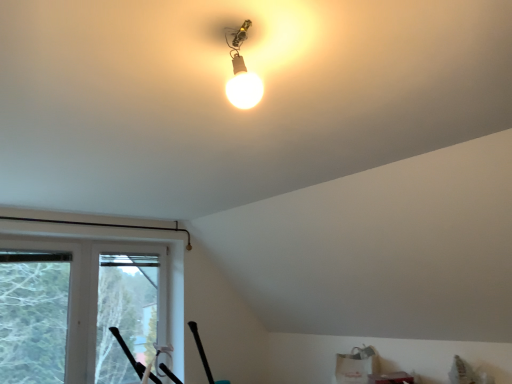
What do you see at coordinates (241, 72) in the screenshot?
I see `matte glass bulb at upper center` at bounding box center [241, 72].

This screenshot has width=512, height=384. What do you see at coordinates (33, 316) in the screenshot?
I see `transparent plastic window screen at left, which is counted as the 1th window screen, starting from the left` at bounding box center [33, 316].

What is the approximate height of transparent plastic window screen at lower left, which appears as the first window screen when viewed from the right?

It is 4.43 feet.

Locate an element on the screen. The image size is (512, 384). matte glass bulb at upper center is located at coordinates (241, 72).

Considering the relative sizes of transparent plastic window screen at left, which is the 2th window screen from right to left, and matte glass bulb at upper center in the image provided, is transparent plastic window screen at left, which is the 2th window screen from right to left, shorter than matte glass bulb at upper center?

No, transparent plastic window screen at left, which is the 2th window screen from right to left, is not shorter than matte glass bulb at upper center.

Is matte glass bulb at upper center located within transparent plastic window screen at left, which is the 2th window screen from right to left?

No, matte glass bulb at upper center is not surrounded by transparent plastic window screen at left, which is the 2th window screen from right to left.

Can you confirm if transparent plastic window screen at left, which is the 2th window screen from right to left, is bigger than matte glass bulb at upper center?

Indeed, transparent plastic window screen at left, which is the 2th window screen from right to left, has a larger size compared to matte glass bulb at upper center.

In the scene shown: Is transparent plastic window screen at left, which is the 2th window screen from right to left, to the left or to the right of matte glass bulb at upper center in the image?

Clearly, transparent plastic window screen at left, which is the 2th window screen from right to left, is on the left of matte glass bulb at upper center in the image.

In the scene shown: From a real-world perspective, is matte glass bulb at upper center physically located above or below transparent plastic window screen at left, which is counted as the 1th window screen, starting from the left?

In terms of real-world spatial position, matte glass bulb at upper center is above transparent plastic window screen at left, which is counted as the 1th window screen, starting from the left.

Could you tell me if matte glass bulb at upper center is turned towards transparent plastic window screen at left, which is the 2th window screen from right to left?

No, matte glass bulb at upper center is not aimed at transparent plastic window screen at left, which is the 2th window screen from right to left.

Between matte glass bulb at upper center and transparent plastic window screen at left, which is the 2th window screen from right to left, which one has larger width?

With larger width is matte glass bulb at upper center.

From a real-world perspective, is transparent plastic window screen at left, which is counted as the 1th window screen, starting from the left, positioned over transparent plastic window screen at lower left, which appears as the first window screen when viewed from the right, based on gravity?

Indeed, from a real-world perspective, transparent plastic window screen at left, which is counted as the 1th window screen, starting from the left, stands above transparent plastic window screen at lower left, which appears as the first window screen when viewed from the right.

Choose the correct answer: Is transparent plastic window screen at left, which is counted as the 1th window screen, starting from the left, inside transparent plastic window screen at lower left, which appears as the second window screen when viewed from the left, or outside it?

transparent plastic window screen at left, which is counted as the 1th window screen, starting from the left, is not enclosed by transparent plastic window screen at lower left, which appears as the second window screen when viewed from the left.

Is transparent plastic window screen at left, which is counted as the 1th window screen, starting from the left, not near transparent plastic window screen at lower left, which appears as the second window screen when viewed from the left?

No, transparent plastic window screen at left, which is counted as the 1th window screen, starting from the left, is not far from transparent plastic window screen at lower left, which appears as the second window screen when viewed from the left.

Which is nearer, (53, 337) or (129, 346)?

The point (53, 337) is more forward.

Considering the relative positions of transparent plastic window screen at lower left, which appears as the second window screen when viewed from the left, and transparent plastic window screen at left, which is counted as the 1th window screen, starting from the left, in the image provided, is transparent plastic window screen at lower left, which appears as the second window screen when viewed from the left, to the left of transparent plastic window screen at left, which is counted as the 1th window screen, starting from the left, from the viewer's perspective?

No, transparent plastic window screen at lower left, which appears as the second window screen when viewed from the left, is not to the left of transparent plastic window screen at left, which is counted as the 1th window screen, starting from the left.

This screenshot has height=384, width=512. In order to click on window screen lying on the right of transparent plastic window screen at left, which is the 2th window screen from right to left in this screenshot , I will do `click(126, 315)`.

Based on the photo, which of these two, transparent plastic window screen at lower left, which appears as the second window screen when viewed from the left, or transparent plastic window screen at left, which is counted as the 1th window screen, starting from the left, is bigger?

transparent plastic window screen at lower left, which appears as the second window screen when viewed from the left, is bigger.

Who is more distant, transparent plastic window screen at lower left, which appears as the second window screen when viewed from the left, or transparent plastic window screen at left, which is the 2th window screen from right to left?

Positioned behind is transparent plastic window screen at lower left, which appears as the second window screen when viewed from the left.

Is matte glass bulb at upper center a part of transparent plastic window screen at lower left, which appears as the first window screen when viewed from the right?

No, matte glass bulb at upper center is not surrounded by transparent plastic window screen at lower left, which appears as the first window screen when viewed from the right.

How far apart are transparent plastic window screen at lower left, which appears as the second window screen when viewed from the left, and matte glass bulb at upper center?

A distance of 3.34 meters exists between transparent plastic window screen at lower left, which appears as the second window screen when viewed from the left, and matte glass bulb at upper center.

Is point (119, 379) closer to viewer compared to point (250, 96)?

No, (119, 379) is further to viewer.

From a real-world perspective, between transparent plastic window screen at lower left, which appears as the first window screen when viewed from the right, and matte glass bulb at upper center, who is vertically lower?

From a 3D spatial view, transparent plastic window screen at lower left, which appears as the first window screen when viewed from the right, is below.

From a real-world perspective, is matte glass bulb at upper center above or below transparent plastic window screen at lower left, which appears as the second window screen when viewed from the left?

matte glass bulb at upper center is situated higher than transparent plastic window screen at lower left, which appears as the second window screen when viewed from the left, in the real world.

Based on the photo, is matte glass bulb at upper center positioned beyond the bounds of transparent plastic window screen at lower left, which appears as the first window screen when viewed from the right?

Indeed, matte glass bulb at upper center is completely outside transparent plastic window screen at lower left, which appears as the first window screen when viewed from the right.

Which of these two, matte glass bulb at upper center or transparent plastic window screen at lower left, which appears as the first window screen when viewed from the right, stands taller?

Standing taller between the two is transparent plastic window screen at lower left, which appears as the first window screen when viewed from the right.

From the image's perspective, is matte glass bulb at upper center over transparent plastic window screen at lower left, which appears as the first window screen when viewed from the right?

Indeed, from the image's perspective, matte glass bulb at upper center is shown above transparent plastic window screen at lower left, which appears as the first window screen when viewed from the right.

The width and height of the screenshot is (512, 384). I want to click on lamp that appears in front of the transparent plastic window screen at left, which is counted as the 1th window screen, starting from the left, so click(241, 72).

Starting from the matte glass bulb at upper center, which window screen is the 1st one behind? Please provide its 2D coordinates.

[(33, 316)]

Looking at this image, looking at the image, which one is located closer to transparent plastic window screen at left, which is the 2th window screen from right to left, matte glass bulb at upper center or transparent plastic window screen at lower left, which appears as the second window screen when viewed from the left?

transparent plastic window screen at lower left, which appears as the second window screen when viewed from the left, is positioned closer to the anchor transparent plastic window screen at left, which is the 2th window screen from right to left.

Looking at the image, which one is located further to transparent plastic window screen at lower left, which appears as the first window screen when viewed from the right, transparent plastic window screen at left, which is the 2th window screen from right to left, or matte glass bulb at upper center?

Among the two, matte glass bulb at upper center is located further to transparent plastic window screen at lower left, which appears as the first window screen when viewed from the right.

When comparing their distances from matte glass bulb at upper center, does transparent plastic window screen at lower left, which appears as the second window screen when viewed from the left, or transparent plastic window screen at left, which is counted as the 1th window screen, starting from the left, seem further?

Among the two, transparent plastic window screen at lower left, which appears as the second window screen when viewed from the left, is located further to matte glass bulb at upper center.

From the image, which object appears to be nearer to transparent plastic window screen at left, which is counted as the 1th window screen, starting from the left, transparent plastic window screen at lower left, which appears as the second window screen when viewed from the left, or matte glass bulb at upper center?

transparent plastic window screen at lower left, which appears as the second window screen when viewed from the left, is positioned closer to the anchor transparent plastic window screen at left, which is counted as the 1th window screen, starting from the left.

Considering their positions, is matte glass bulb at upper center positioned further to transparent plastic window screen at lower left, which appears as the first window screen when viewed from the right, than transparent plastic window screen at left, which is the 2th window screen from right to left?

Based on the image, matte glass bulb at upper center appears to be further to transparent plastic window screen at lower left, which appears as the first window screen when viewed from the right.

Estimate the real-world distances between objects in this image. Which object is further from matte glass bulb at upper center, transparent plastic window screen at left, which is counted as the 1th window screen, starting from the left, or transparent plastic window screen at lower left, which appears as the first window screen when viewed from the right?

transparent plastic window screen at lower left, which appears as the first window screen when viewed from the right, is positioned further to the anchor matte glass bulb at upper center.

Identify the location of window screen between matte glass bulb at upper center and transparent plastic window screen at lower left, which appears as the second window screen when viewed from the left, in the front-back direction. The height and width of the screenshot is (384, 512). (33, 316).